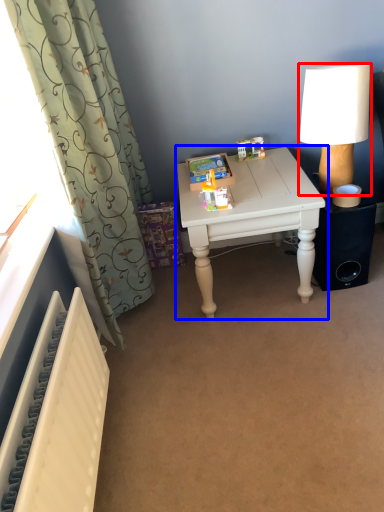
Question: Among these objects, which one is nearest to the camera, lamp (highlighted by a red box) or table (highlighted by a blue box)?

Choices:
 (A) lamp
 (B) table

Answer: (A)